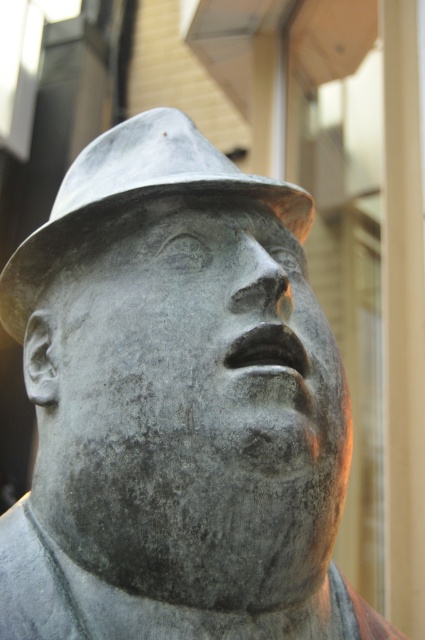
Question: Which point is farther to the camera?

Choices:
 (A) bronze textured fedora at center
 (B) gray stone face at center

Answer: (A)

Question: Which point appears farthest from the camera in this image?

Choices:
 (A) (48, 234)
 (B) (155, 392)

Answer: (A)

Question: Does gray stone face at center have a greater width compared to bronze textured fedora at center?

Choices:
 (A) no
 (B) yes

Answer: (A)

Question: Is gray stone face at center positioned behind bronze textured fedora at center?

Choices:
 (A) no
 (B) yes

Answer: (A)

Question: Does gray stone face at center come behind bronze textured fedora at center?

Choices:
 (A) no
 (B) yes

Answer: (A)